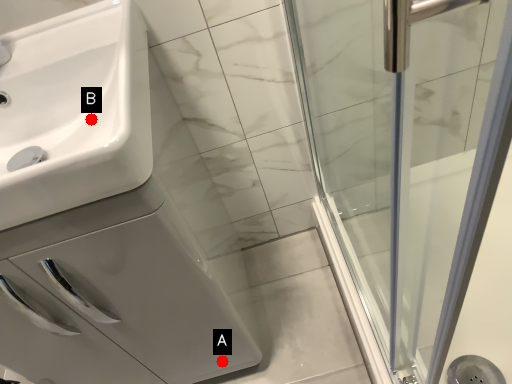
Question: Two points are circled on the image, labeled by A and B beside each circle. Among these points, which one is nearest to the camera?

Choices:
 (A) A is closer
 (B) B is closer

Answer: (B)